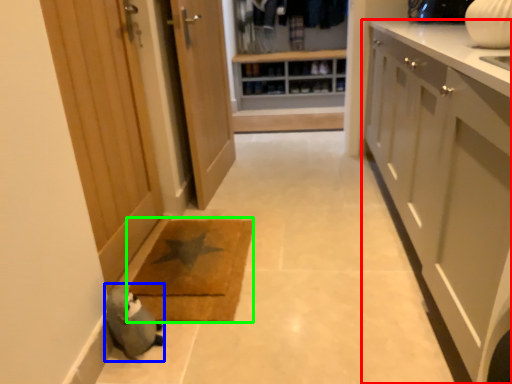
Question: Which object is the farthest from cabinetry (highlighted by a red box)? Choose among these: animal (highlighted by a blue box) or mat (highlighted by a green box).

Choices:
 (A) animal
 (B) mat

Answer: (A)